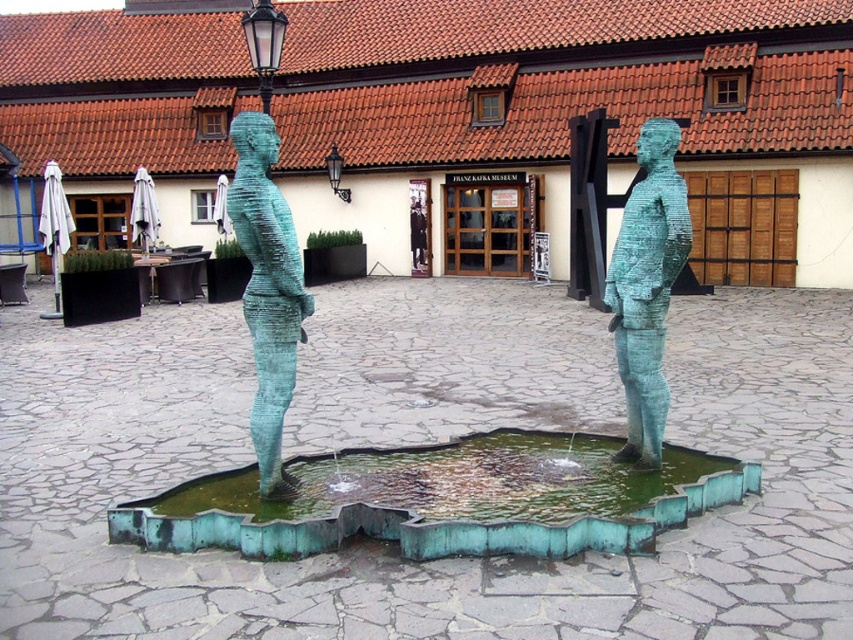
Does point (296, 552) lie in front of point (270, 28)?

Yes, it is in front of point (270, 28).

Can you confirm if green patina water at center is thinner than green patina lamp post at upper center?

Yes.

Who is more forward, (520, 470) or (283, 29)?

Positioned in front is point (520, 470).

Locate an element on the screen. green patina water at center is located at coordinates (445, 499).

Can you confirm if green patina water at center is smaller than green patinated bronze statue at center?

No, green patina water at center is not smaller than green patinated bronze statue at center.

Does point (505, 538) come closer to viewer compared to point (254, 273)?

That is True.

Which is behind, point (508, 472) or point (288, 248)?

Positioned behind is point (508, 472).

Identify the location of green patina water at center. The width and height of the screenshot is (853, 640). (445, 499).

The height and width of the screenshot is (640, 853). I want to click on green patinated bronze statue at center, so click(x=267, y=289).

Which is in front, point (287, 378) or point (260, 72)?

Point (287, 378)

Between point (250, 307) and point (254, 8), which one is positioned behind?

The point (254, 8) is behind.

Locate an element on the screen. green patinated bronze statue at center is located at coordinates (267, 289).